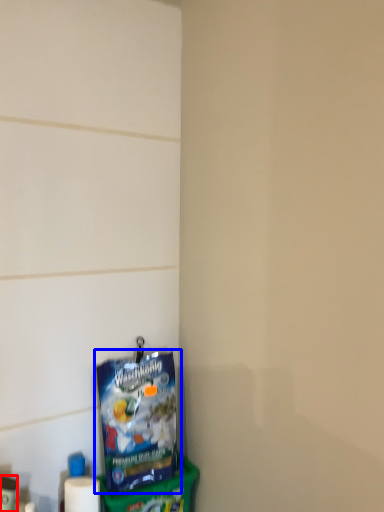
Question: Which point is further to the camera, toiletry (highlighted by a red box) or toy (highlighted by a blue box)?

Choices:
 (A) toiletry
 (B) toy

Answer: (B)